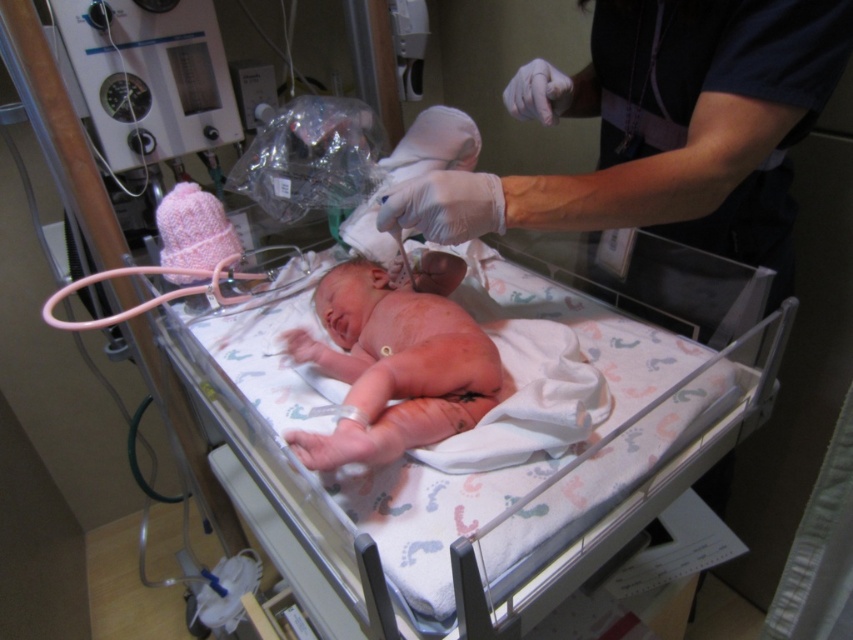
Looking at this image, you are a nurse in the neonatal ICU and need to access the pink fabric newborn at center for a medical procedure. Is the white latex gloves at upper center blocking your direct access to the newborn?

The white latex gloves at upper center is located above the pink fabric newborn at center, so it is blocking the direct access to the newborn.

You are a nurse in the neonatal ICU. You need to place a small medical tool between the two points labeled as point [416,180] and point [370,448]. Which point should the tool be closer to in order to ensure it is placed at the same depth as the camera?

The tool should be placed closer to point [370,448] because point [416,180] is further away from the camera. This ensures the tool is at the same depth as the camera.

You are a nurse in the neonatal ICU. You need to ensure that the white latex gloves at upper center can comfortably fit over the pink fabric newborn at center. Based on the size comparison provided, will the gloves fit properly?

The white latex gloves at upper center are larger in size than the pink fabric newborn at center, so they should fit comfortably over the newborn without being too tight.